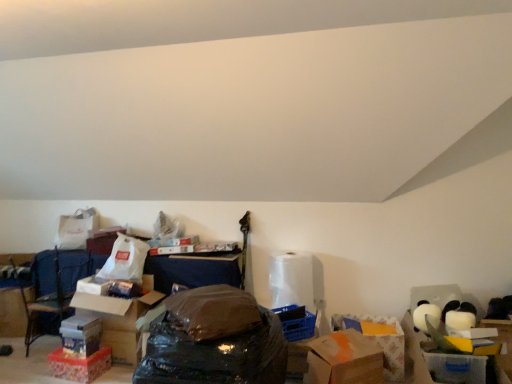
Describe the element at coordinates (193, 270) in the screenshot. I see `brown paper bag at center` at that location.

Measure the distance between point (475, 363) and camera.

Point (475, 363) is 2.54 meters away from camera.

How much space does matte cardboard box at lower left, arranged as the third storage box when viewed from the front, occupy vertically?

matte cardboard box at lower left, arranged as the third storage box when viewed from the front, is 5.26 inches in height.

Image resolution: width=512 pixels, height=384 pixels. What do you see at coordinates (80, 336) in the screenshot? I see `matte cardboard box at lower left, arranged as the third storage box when viewed from the front` at bounding box center [80, 336].

Image resolution: width=512 pixels, height=384 pixels. What do you see at coordinates (344, 359) in the screenshot? I see `brown cardboard box at lower right` at bounding box center [344, 359].

What do you see at coordinates (214, 341) in the screenshot?
I see `brown plastic bag at center` at bounding box center [214, 341].

This screenshot has height=384, width=512. I want to click on cardboard box at lower left, marked as the 1th cardboard box in a left-to-right arrangement, so click(115, 317).

At what (x,y) coordinates should I click in order to perform the action: click on orange matte cardboard box at center, placed as the second cardboard box when sorted from left to right. Please return your answer as a coordinate pair (x, y). The width and height of the screenshot is (512, 384). Looking at the image, I should click on (379, 341).

Which of these two, translucent plastic storage box at lower left, which is the 2th storage box from front to back, or brown cardboard box at lower right, is wider?

With larger width is brown cardboard box at lower right.

Is brown cardboard box at lower right surrounded by translucent plastic storage box at lower left, which ranks as the third storage box in right-to-left order?

That's incorrect, brown cardboard box at lower right is not inside translucent plastic storage box at lower left, which ranks as the third storage box in right-to-left order.

Which object is further away from the camera taking this photo, translucent plastic storage box at lower left, positioned as the second storage box in back-to-front order, or brown cardboard box at lower right?

translucent plastic storage box at lower left, positioned as the second storage box in back-to-front order, is behind.

Is the position of brown plastic bag at center more distant than that of matte cardboard box at lower left, arranged as the third storage box when viewed from the front?

No, brown plastic bag at center is closer to the viewer.

From a real-world perspective, is brown plastic bag at center above or below matte cardboard box at lower left, arranged as the third storage box when viewed from the front?

Clearly, from a real-world perspective, brown plastic bag at center is above matte cardboard box at lower left, arranged as the third storage box when viewed from the front.

Is brown plastic bag at center turned away from matte cardboard box at lower left, arranged as the third storage box when viewed from the front?

brown plastic bag at center does not have its back to matte cardboard box at lower left, arranged as the third storage box when viewed from the front.

Does point (226, 352) come closer to viewer compared to point (63, 322)?

Yes, it is.

Is white matte toilet paper at center not near translucent plastic storage box at lower left, which ranks as the third storage box in right-to-left order?

Yes, white matte toilet paper at center and translucent plastic storage box at lower left, which ranks as the third storage box in right-to-left order, are located far from each other.

I want to click on the 3rd storage box positioned below the white matte toilet paper at center (from the image's perspective), so click(x=80, y=365).

Which is closer, [307,298] or [108,366]?

Point [307,298] is farther from the camera than point [108,366].

Is white matte toilet paper at center looking in the opposite direction of translucent plastic storage box at lower left, which ranks as the third storage box in right-to-left order?

white matte toilet paper at center is not turned away from translucent plastic storage box at lower left, which ranks as the third storage box in right-to-left order.

Do you think brown cardboard box at lower right is within white matte toilet paper at center, or outside of it?

brown cardboard box at lower right is not inside white matte toilet paper at center, it's outside.

Who is bigger, brown cardboard box at lower right or white matte toilet paper at center?

brown cardboard box at lower right is bigger.

In the image, is brown cardboard box at lower right positioned in front of or behind white matte toilet paper at center?

In the image, brown cardboard box at lower right appears in front of white matte toilet paper at center.

Is brown cardboard box at lower right shorter than brown plastic bag at center?

Indeed, brown cardboard box at lower right has a lesser height compared to brown plastic bag at center.

Could you tell me if brown cardboard box at lower right is facing brown plastic bag at center?

No.

How different are the orientations of brown cardboard box at lower right and brown plastic bag at center in degrees?

They differ by 44 degrees in their facing directions.

Is cardboard box at lower left, marked as the 1th cardboard box in a left-to-right arrangement, thinner than brown plastic bag at center?

Indeed, cardboard box at lower left, marked as the 1th cardboard box in a left-to-right arrangement, has a lesser width compared to brown plastic bag at center.

Is cardboard box at lower left, acting as the second cardboard box starting from the right, surrounding brown plastic bag at center?

No, brown plastic bag at center is not a part of cardboard box at lower left, acting as the second cardboard box starting from the right.

From a real-world perspective, is cardboard box at lower left, marked as the 1th cardboard box in a left-to-right arrangement, physically above brown plastic bag at center?

No, from a real-world perspective, cardboard box at lower left, marked as the 1th cardboard box in a left-to-right arrangement, is not over brown plastic bag at center

Find the location of a particular element. The height and width of the screenshot is (384, 512). the 2nd cardboard box below the brown plastic bag at center (from a real-world perspective) is located at coordinates (115, 317).

Considering their positions, is orange matte cardboard box at center, placed as the second cardboard box when sorted from left to right, located in front of or behind white matte toilet paper at center?

orange matte cardboard box at center, placed as the second cardboard box when sorted from left to right, is positioned closer to the viewer than white matte toilet paper at center.

From the image's perspective, is orange matte cardboard box at center, placed as the second cardboard box when sorted from left to right, under white matte toilet paper at center?

Yes, from the image's perspective, orange matte cardboard box at center, placed as the second cardboard box when sorted from left to right, is beneath white matte toilet paper at center.

Which object is thinner, orange matte cardboard box at center, placed as the second cardboard box when sorted from left to right, or white matte toilet paper at center?

With smaller width is white matte toilet paper at center.

Is orange matte cardboard box at center, which is the first cardboard box from right to left, to the right of white matte toilet paper at center from the viewer's perspective?

Yes, orange matte cardboard box at center, which is the first cardboard box from right to left, is to the right of white matte toilet paper at center.

Identify the location of box that appears in front of the translucent plastic storage box at lower left, which ranks as the third storage box in right-to-left order. The image size is (512, 384). (344, 359).

Find the location of `garbage that appears on the right of matte cardboard box at lower left, which appears as the 2th storage box when viewed from the left`. garbage that appears on the right of matte cardboard box at lower left, which appears as the 2th storage box when viewed from the left is located at coordinates (214, 341).

From the image, which object appears to be farther from orange matte cardboard box at center, which is the first cardboard box from right to left, brown cardboard box at lower right or blue fabric armchair at lower left?

The object further to orange matte cardboard box at center, which is the first cardboard box from right to left, is blue fabric armchair at lower left.

From the image, which object appears to be farther from translucent plastic storage box at lower right, placed as the 3th storage box when sorted from left to right, matte cardboard box at lower left, which appears as the 2th storage box when viewed from the left, or brown paper bag at center?

brown paper bag at center.

When comparing their distances from cardboard box at lower left, acting as the second cardboard box starting from the right, does brown plastic bag at center or orange matte cardboard box at center, placed as the second cardboard box when sorted from left to right, seem further?

Among the two, orange matte cardboard box at center, placed as the second cardboard box when sorted from left to right, is located further to cardboard box at lower left, acting as the second cardboard box starting from the right.

Looking at the image, which one is located closer to brown plastic bag at center, blue fabric armchair at lower left or matte cardboard box at lower left, which ranks as the first storage box in back-to-front order?

matte cardboard box at lower left, which ranks as the first storage box in back-to-front order, is closer to brown plastic bag at center.

Estimate the real-world distances between objects in this image. Which object is closer to cardboard box at lower left, acting as the second cardboard box starting from the right, orange matte cardboard box at center, placed as the second cardboard box when sorted from left to right, or blue fabric armchair at lower left?

Among the two, blue fabric armchair at lower left is located nearer to cardboard box at lower left, acting as the second cardboard box starting from the right.

Looking at the image, which one is located further to brown cardboard box at lower right, translucent plastic storage box at lower left, which is the 2th storage box from front to back, or brown plastic bag at center?

translucent plastic storage box at lower left, which is the 2th storage box from front to back, lies further to brown cardboard box at lower right than the other object.

Considering their positions, is brown paper bag at center positioned closer to brown cardboard box at lower right than translucent plastic storage box at lower left, marked as the first storage box in a left-to-right arrangement?

translucent plastic storage box at lower left, marked as the first storage box in a left-to-right arrangement, is positioned closer to the anchor brown cardboard box at lower right.

Which object lies nearer to the anchor point orange matte cardboard box at center, placed as the second cardboard box when sorted from left to right, white matte toilet paper at center or blue fabric armchair at lower left?

Among the two, white matte toilet paper at center is located nearer to orange matte cardboard box at center, placed as the second cardboard box when sorted from left to right.

In order to click on table situated between translucent plastic storage box at lower left, which is the 2th storage box from front to back, and orange matte cardboard box at center, which is the first cardboard box from right to left, from left to right in this screenshot , I will do `click(193, 270)`.

The height and width of the screenshot is (384, 512). I want to click on box between brown paper bag at center and translucent plastic storage box at lower right, the first storage box viewed from the front, from left to right, so click(x=344, y=359).

Find the location of a particular element. cardboard box situated between translucent plastic storage box at lower left, which is the 2th storage box from front to back, and white matte toilet paper at center from left to right is located at coordinates (115, 317).

Find the location of a particular element. The width and height of the screenshot is (512, 384). box located between cardboard box at lower left, marked as the 1th cardboard box in a left-to-right arrangement, and translucent plastic storage box at lower right, placed as the 3th storage box when sorted from left to right, in the left-right direction is located at coordinates (344, 359).